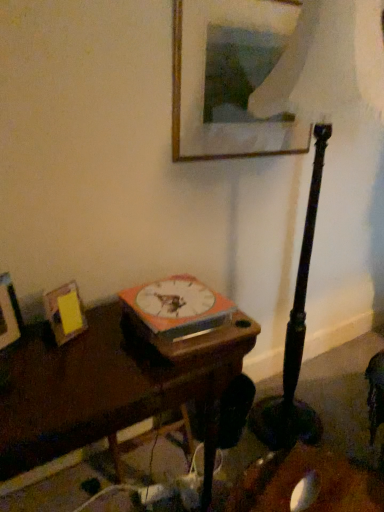
Locate an element on the screen. yellow paper at left, arranged as the 2th picture frame when ordered from the bottom is located at coordinates (65, 312).

The width and height of the screenshot is (384, 512). Find the location of `dark wood table at center`. dark wood table at center is located at coordinates (107, 387).

Based on the photo, is the surface of matte black lamp at center in direct contact with orange matte book at center?

matte black lamp at center and orange matte book at center are clearly separated.

You are a GUI agent. You are given a task and a screenshot of the screen. Output one action in this format:
    pyautogui.click(x=<x>, y=<y>)
    Task: Click on the paperback book located on the left of matte black lamp at center
    The image size is (384, 512).
    Given the screenshot: What is the action you would take?
    pyautogui.click(x=178, y=307)

Would you say matte black lamp at center is inside or outside orange matte book at center?

matte black lamp at center cannot be found inside orange matte book at center.

Is wooden picture frame at upper center, acting as the 1th picture frame starting from the right, taller or shorter than wooden photo frame at left, the third picture frame in the top-to-bottom sequence?

In the image, wooden picture frame at upper center, acting as the 1th picture frame starting from the right, appears to be taller than wooden photo frame at left, the third picture frame in the top-to-bottom sequence.

From the image's perspective, who appears lower, wooden picture frame at upper center, which is counted as the 3th picture frame, starting from the bottom, or wooden photo frame at left, the 1th picture frame from the bottom?

A: wooden photo frame at left, the 1th picture frame from the bottom.

Is wooden picture frame at upper center, acting as the 1th picture frame starting from the right, next to wooden photo frame at left, the third picture frame from the right, and touching it?

No, wooden picture frame at upper center, acting as the 1th picture frame starting from the right, is not in contact with wooden photo frame at left, the third picture frame from the right.

Is point (263, 4) behind point (3, 307)?

That is True.

Does wooden picture frame at upper center, marked as the 1th picture frame in a top-to-bottom arrangement, have a greater width compared to yellow paper at left, which is the 2th picture frame in left-to-right order?

No, wooden picture frame at upper center, marked as the 1th picture frame in a top-to-bottom arrangement, is not wider than yellow paper at left, which is the 2th picture frame in left-to-right order.

Is wooden picture frame at upper center, acting as the 1th picture frame starting from the right, facing away from yellow paper at left, the second picture frame when ordered from top to bottom?

wooden picture frame at upper center, acting as the 1th picture frame starting from the right, is not turned away from yellow paper at left, the second picture frame when ordered from top to bottom.

Does wooden picture frame at upper center, marked as the 1th picture frame in a top-to-bottom arrangement, have a greater height compared to yellow paper at left, arranged as the 2th picture frame when ordered from the bottom?

Yes, wooden picture frame at upper center, marked as the 1th picture frame in a top-to-bottom arrangement, is taller than yellow paper at left, arranged as the 2th picture frame when ordered from the bottom.

From a real-world perspective, is orange matte book at center physically located above or below wooden photo frame at left, the 1th picture frame from the bottom?

orange matte book at center is below wooden photo frame at left, the 1th picture frame from the bottom.

Consider the image. Is orange matte book at center located outside wooden photo frame at left, the 1th picture frame from the bottom?

That's correct, orange matte book at center is outside of wooden photo frame at left, the 1th picture frame from the bottom.

Considering the positions of point (195, 317) and point (0, 321), is point (195, 317) closer or farther from the camera than point (0, 321)?

Point (195, 317) appears to be farther away from the viewer than point (0, 321).

Are orange matte book at center and wooden photo frame at left, the first picture frame in the left-to-right sequence, far apart?

No.

Is wooden photo frame at left, the third picture frame in the top-to-bottom sequence, at the right side of dark wood table at center?

Incorrect, wooden photo frame at left, the third picture frame in the top-to-bottom sequence, is not on the right side of dark wood table at center.

From the image's perspective, is wooden photo frame at left, the first picture frame in the left-to-right sequence, under dark wood table at center?

No.

Who is taller, wooden photo frame at left, the first picture frame in the left-to-right sequence, or dark wood table at center?

dark wood table at center.

Is wooden photo frame at left, the third picture frame in the top-to-bottom sequence, oriented away from dark wood table at center?

No, dark wood table at center is not at the back of wooden photo frame at left, the third picture frame in the top-to-bottom sequence.

From the image's perspective, is yellow paper at left, which is the 2th picture frame in left-to-right order, located above orange matte book at center?

No, from the image's perspective, yellow paper at left, which is the 2th picture frame in left-to-right order, is not above orange matte book at center.

From a real-world perspective, who is located higher, yellow paper at left, which is the 2th picture frame in left-to-right order, or orange matte book at center?

From a 3D spatial view, orange matte book at center is above.

Considering the positions of points (74, 317) and (197, 324), is point (74, 317) farther from camera compared to point (197, 324)?

Yes, it is.

Is dark wood table at center situated inside yellow paper at left, which is the 2th picture frame in left-to-right order, or outside?

dark wood table at center is outside yellow paper at left, which is the 2th picture frame in left-to-right order.

From the image's perspective, is dark wood table at center positioned above or below yellow paper at left, arranged as the 2th picture frame when ordered from the bottom?

Clearly, from the image's perspective, dark wood table at center is below yellow paper at left, arranged as the 2th picture frame when ordered from the bottom.

In the scene shown: Is dark wood table at center positioned behind yellow paper at left, the 2th picture frame viewed from the right?

No, the depth of dark wood table at center is less than that of yellow paper at left, the 2th picture frame viewed from the right.

How distant is dark wood table at center from yellow paper at left, arranged as the 2th picture frame when ordered from the bottom?

dark wood table at center is 9.11 inches from yellow paper at left, arranged as the 2th picture frame when ordered from the bottom.

Locate an element on the screen. This screenshot has height=512, width=384. paperback book below the matte black lamp at center (from the image's perspective) is located at coordinates (178, 307).

The width and height of the screenshot is (384, 512). What are the coordinates of `the 2nd picture frame to the left of the wooden picture frame at upper center, which is counted as the 3th picture frame, starting from the bottom, counting from the anchor's position` in the screenshot? It's located at (9, 313).

Which object lies further to the anchor point orange matte book at center, matte black lamp at center or dark wood table at center?

matte black lamp at center is further to orange matte book at center.

When comparing their distances from yellow paper at left, arranged as the 2th picture frame when ordered from the bottom, does wooden picture frame at upper center, the third picture frame when ordered from left to right, or dark wood table at center seem closer?

Among the two, dark wood table at center is located nearer to yellow paper at left, arranged as the 2th picture frame when ordered from the bottom.

Looking at the image, which one is located closer to wooden photo frame at left, the 1th picture frame from the bottom, matte black lamp at center or orange matte book at center?

orange matte book at center lies closer to wooden photo frame at left, the 1th picture frame from the bottom, than the other object.

Based on their spatial positions, is wooden photo frame at left, the first picture frame in the left-to-right sequence, or matte black lamp at center further from wooden picture frame at upper center, marked as the 1th picture frame in a top-to-bottom arrangement?

Among the two, wooden photo frame at left, the first picture frame in the left-to-right sequence, is located further to wooden picture frame at upper center, marked as the 1th picture frame in a top-to-bottom arrangement.

Which object lies nearer to the anchor point yellow paper at left, arranged as the 2th picture frame when ordered from the bottom, wooden photo frame at left, the 1th picture frame from the bottom, or wooden picture frame at upper center, the third picture frame when ordered from left to right?

wooden photo frame at left, the 1th picture frame from the bottom, is positioned closer to the anchor yellow paper at left, arranged as the 2th picture frame when ordered from the bottom.

When comparing their distances from yellow paper at left, arranged as the 2th picture frame when ordered from the bottom, does matte black lamp at center or wooden picture frame at upper center, acting as the 1th picture frame starting from the right, seem closer?

wooden picture frame at upper center, acting as the 1th picture frame starting from the right, lies closer to yellow paper at left, arranged as the 2th picture frame when ordered from the bottom, than the other object.

Looking at the image, which one is located closer to orange matte book at center, wooden photo frame at left, the third picture frame in the top-to-bottom sequence, or yellow paper at left, the 2th picture frame viewed from the right?

yellow paper at left, the 2th picture frame viewed from the right, is positioned closer to the anchor orange matte book at center.

Which object lies nearer to the anchor point wooden picture frame at upper center, which is counted as the 3th picture frame, starting from the bottom, matte black lamp at center or orange matte book at center?

matte black lamp at center is positioned closer to the anchor wooden picture frame at upper center, which is counted as the 3th picture frame, starting from the bottom.

Identify the location of paperback book located between dark wood table at center and matte black lamp at center in the left-right direction. click(178, 307).

This screenshot has width=384, height=512. I want to click on picture frame that lies between yellow paper at left, which is the 2th picture frame in left-to-right order, and dark wood table at center from top to bottom, so click(9, 313).

Where is `table lamp between wooden picture frame at upper center, marked as the 1th picture frame in a top-to-bottom arrangement, and dark wood table at center from top to bottom`? This screenshot has height=512, width=384. table lamp between wooden picture frame at upper center, marked as the 1th picture frame in a top-to-bottom arrangement, and dark wood table at center from top to bottom is located at coordinates (317, 158).

I want to click on paperback book between wooden photo frame at left, the third picture frame in the top-to-bottom sequence, and matte black lamp at center, so click(x=178, y=307).